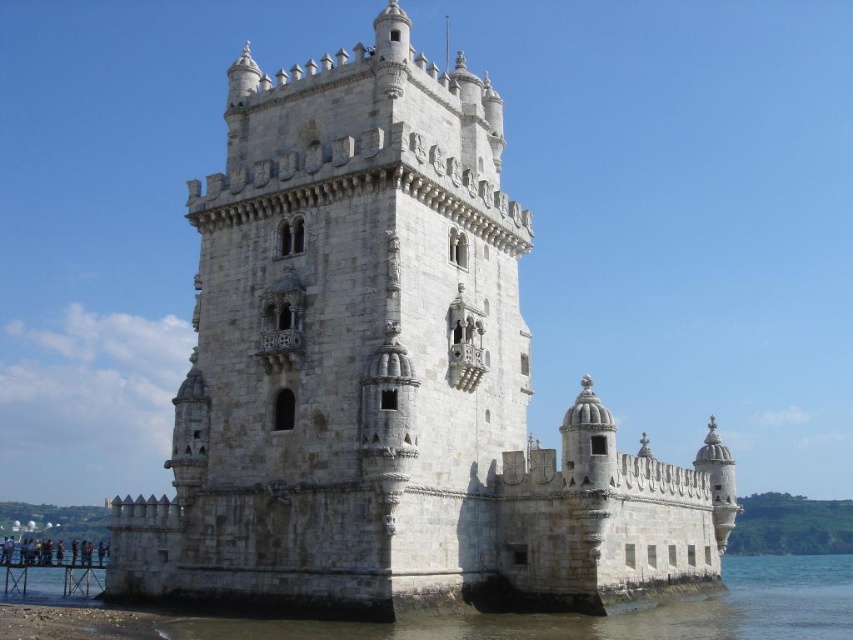
You are a tourist standing on the shore looking at the white stone castle at center and the clear water at lower left. Which object appears taller from your perspective?

The white stone castle at center appears taller than the clear water at lower left from your perspective.

You are standing in front of the Torre de Belm and want to take a photo of the tower. You notice two specific points on the tower labeled as point (402,592) and point (820,637). Which of these points is closer to you when you are facing the tower?

Point (402,592) is closer to the viewer than point (820,637).